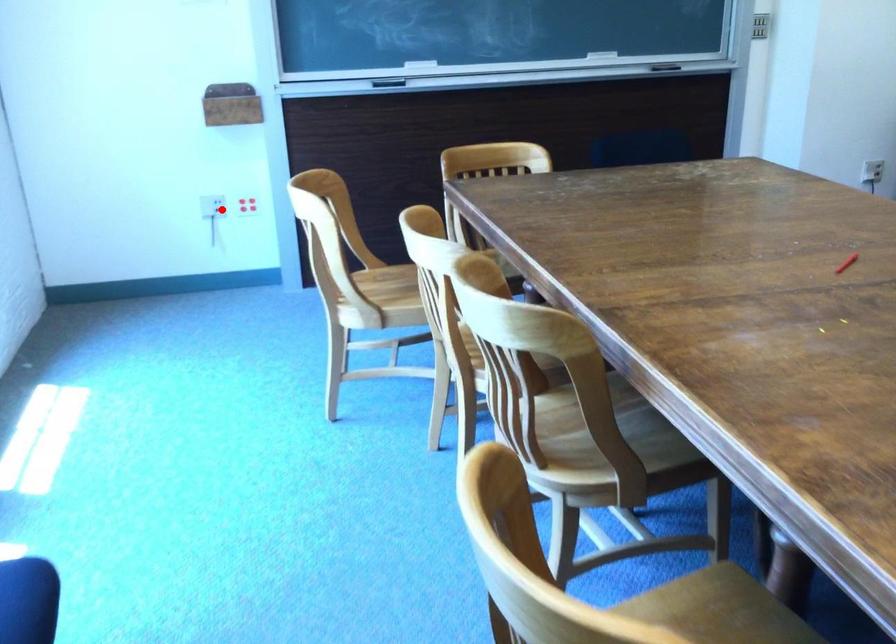
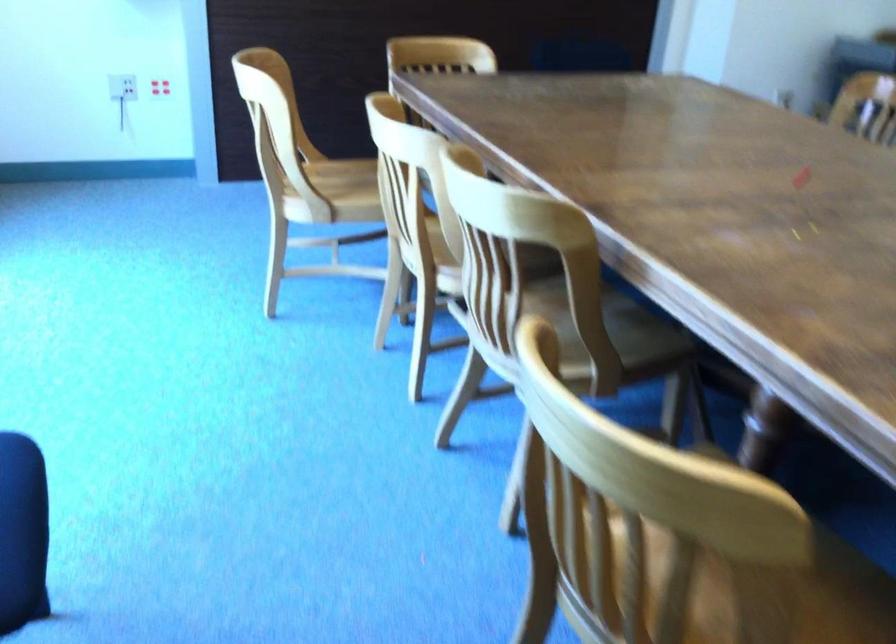
Locate, in the second image, the point that corresponds to the highlighted location in the first image.

(122, 87)